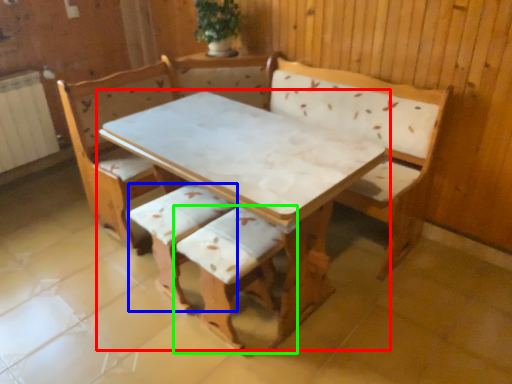
Question: Which is farther away from table (highlighted by a red box)? armchair (highlighted by a blue box) or armchair (highlighted by a green box)?

Choices:
 (A) armchair
 (B) armchair

Answer: (A)